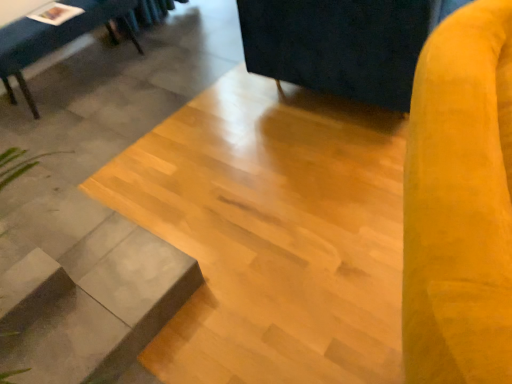
The width and height of the screenshot is (512, 384). I want to click on free spot in front of matte black table at upper left, so click(x=102, y=123).